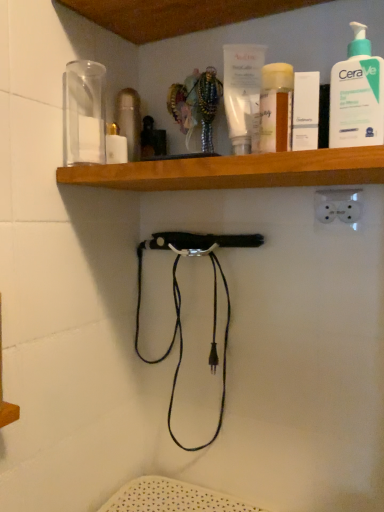
Question: Is white matte box at upper center facing away from wooden at upper center?

Choices:
 (A) no
 (B) yes

Answer: (A)

Question: Considering the relative sizes of white matte box at upper center and wooden at upper center in the image provided, is white matte box at upper center bigger than wooden at upper center?

Choices:
 (A) yes
 (B) no

Answer: (B)

Question: Considering the relative sizes of white matte box at upper center and wooden at upper center in the image provided, is white matte box at upper center shorter than wooden at upper center?

Choices:
 (A) no
 (B) yes

Answer: (A)

Question: Is white matte box at upper center to the right of wooden at upper center from the viewer's perspective?

Choices:
 (A) yes
 (B) no

Answer: (A)

Question: Is white matte box at upper center aimed at wooden at upper center?

Choices:
 (A) yes
 (B) no

Answer: (B)

Question: Choose the correct answer: Is wooden at upper center inside white matte box at upper center or outside it?

Choices:
 (A) inside
 (B) outside

Answer: (B)

Question: Considering the positions of wooden at upper center and white matte box at upper center in the image, is wooden at upper center taller or shorter than white matte box at upper center?

Choices:
 (A) tall
 (B) short

Answer: (B)

Question: From the image's perspective, relative to white matte box at upper center, is wooden at upper center above or below?

Choices:
 (A) above
 (B) below

Answer: (B)

Question: From a real-world perspective, is wooden at upper center above or below white matte box at upper center?

Choices:
 (A) above
 (B) below

Answer: (B)

Question: From a real-world perspective, is white matte box at upper center physically located above or below wooden at upper center?

Choices:
 (A) below
 (B) above

Answer: (B)

Question: Is white matte box at upper center in front of or behind wooden at upper center in the image?

Choices:
 (A) behind
 (B) front

Answer: (A)

Question: Would you say white matte box at upper center is to the left or to the right of wooden at upper center in the picture?

Choices:
 (A) left
 (B) right

Answer: (B)

Question: From the image's perspective, is white matte box at upper center above or below wooden at upper center?

Choices:
 (A) below
 (B) above

Answer: (B)

Question: From a real-world perspective, is wooden at upper center physically located above or below white pump bottle at upper right?

Choices:
 (A) above
 (B) below

Answer: (B)

Question: Is wooden at upper center inside the boundaries of white pump bottle at upper right, or outside?

Choices:
 (A) outside
 (B) inside

Answer: (A)